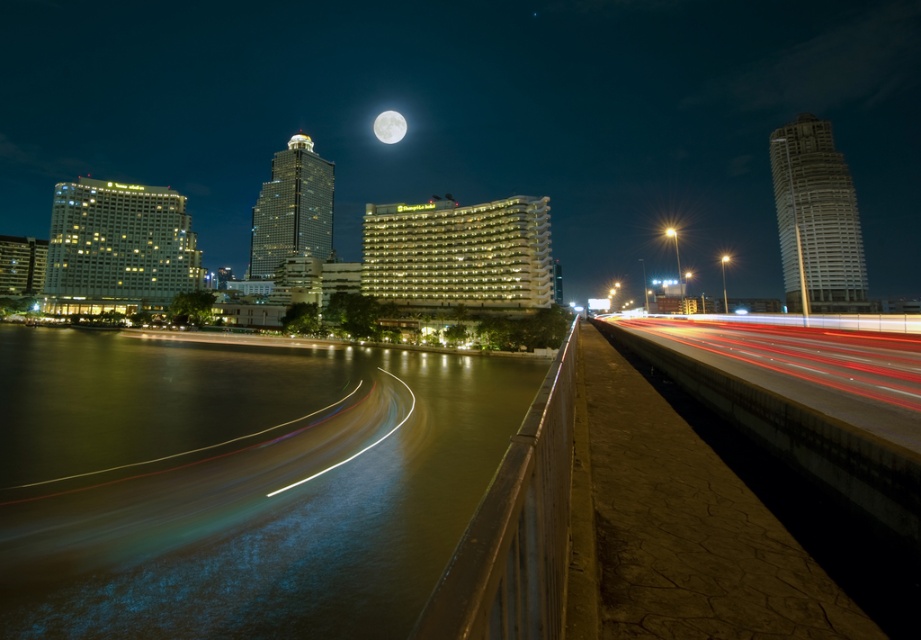
From the picture: You are a drone operator trying to capture a photo of the smooth concrete highway at right. To ensure the highway is centered in your shot, what coordinates should you aim for?

The smooth concrete highway at right is located at coordinates (809, 365), so you should aim for those coordinates to center it in your photo.

You are a photographer trying to capture the white glossy moon at upper center and the greenish water at lower left in a single shot. Which object will appear larger in the photo?

The greenish water at lower left will appear larger in the photo because it is bigger than the white glossy moon at upper center.

You are a photographer standing on the bridge and want to capture both the smooth concrete highway at right and the white glossy moon at upper center in a single shot. Which object will appear smaller in the photo?

The smooth concrete highway at right will appear smaller in the photo because it is shorter than the white glossy moon at upper center.